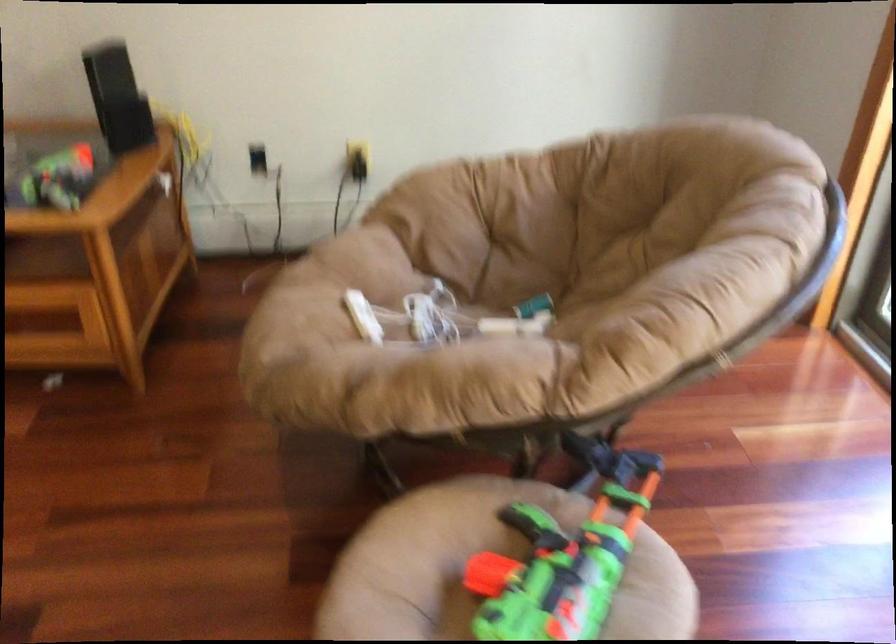
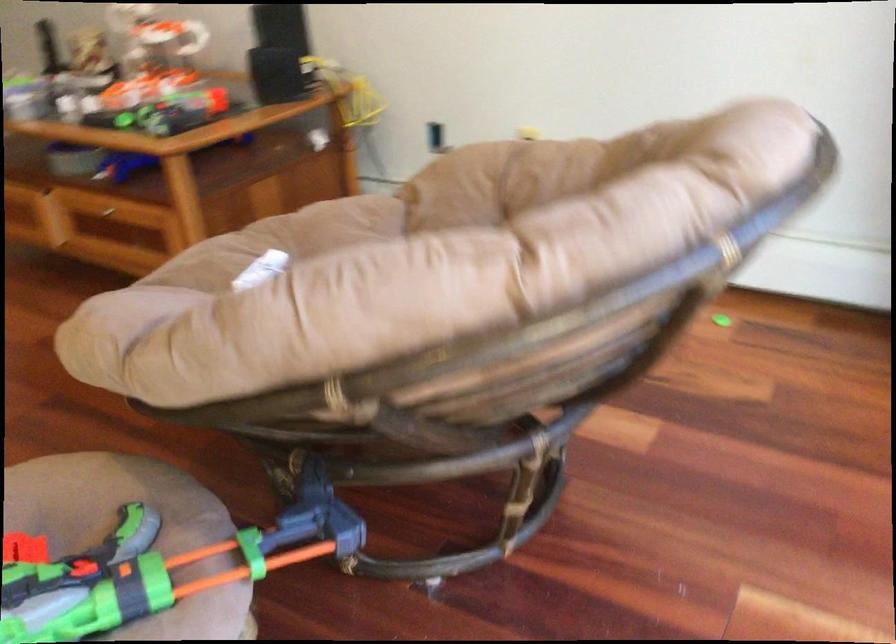
Find the pixel in the second image that matches [567,516] in the first image.

(133, 532)